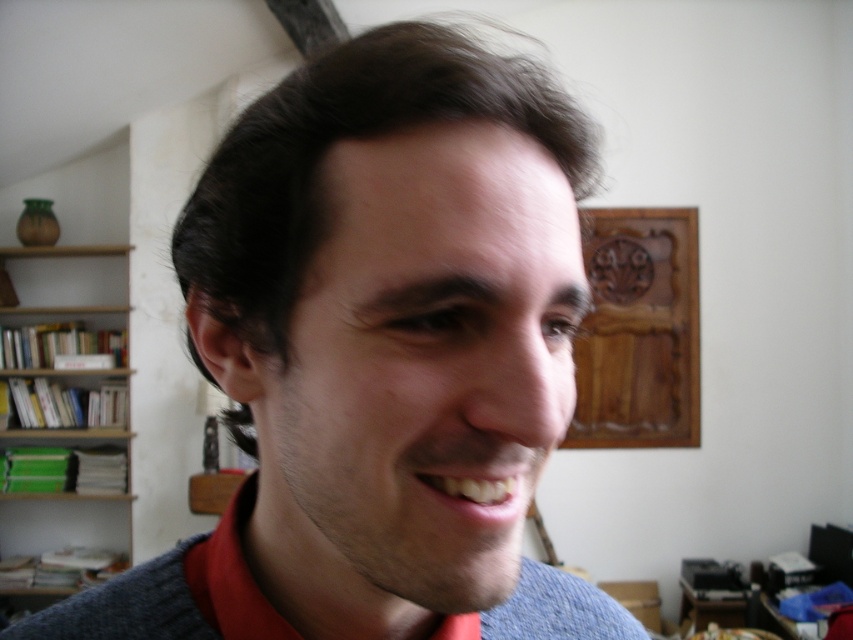
Who is higher up, gray wool sweater at center or wooden shelves at left?

Positioned higher is gray wool sweater at center.

Does gray wool sweater at center have a lesser height compared to wooden shelves at left?

Yes.

Who is more forward, (467,104) or (61,321)?

Point (467,104) is more forward.

I want to click on gray wool sweater at center, so click(379, 355).